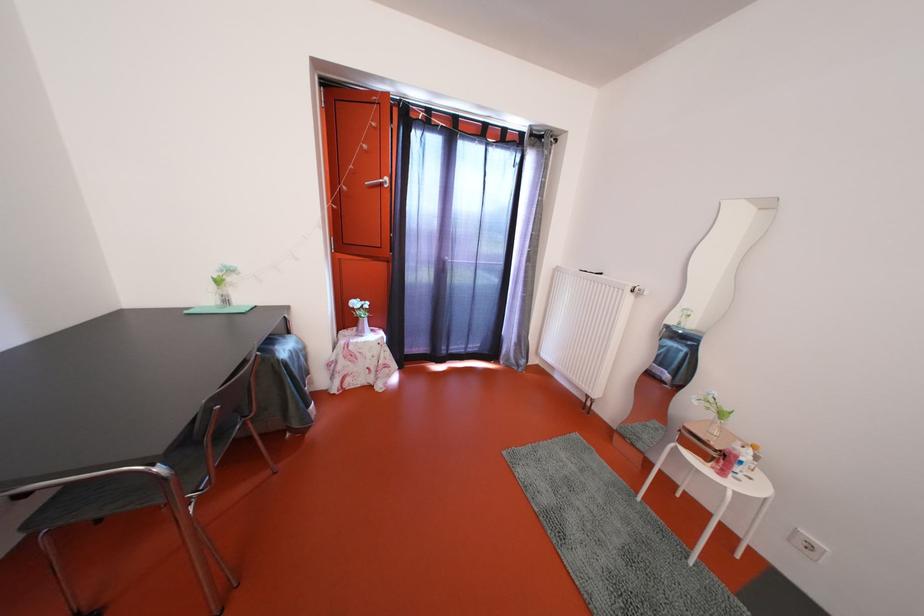
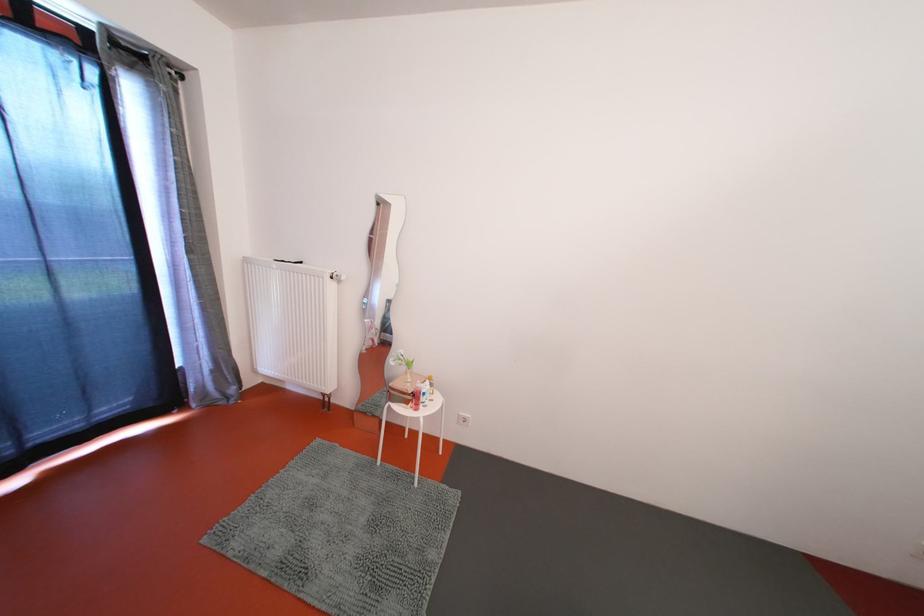
The point at (639, 297) is marked in the first image. Where is the corresponding point in the second image?

(338, 283)